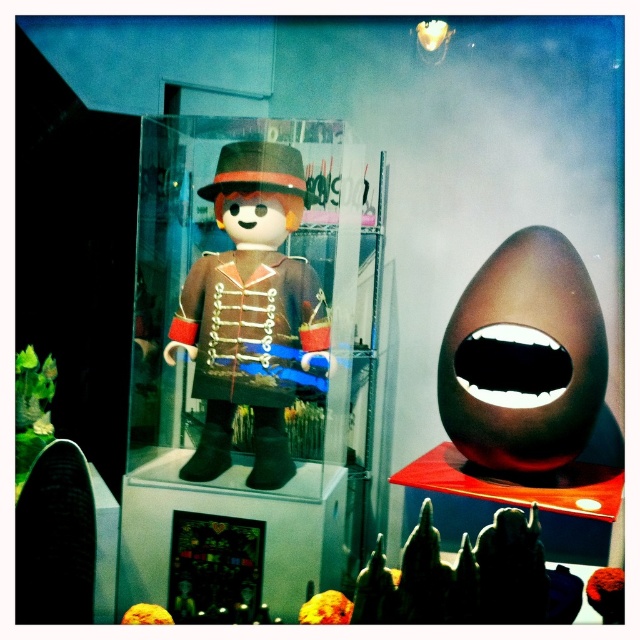
You are a customer in a store looking at the display. You see the matte brown toy at center and the golden textured ball at center. Which one is placed higher?

The matte brown toy at center is placed higher than the golden textured ball at center.

You are a customer in a store looking at the display. You see the matte brown toy at center and the golden textured ball at center. Which one is more to the left?

The matte brown toy at center is more to the left.